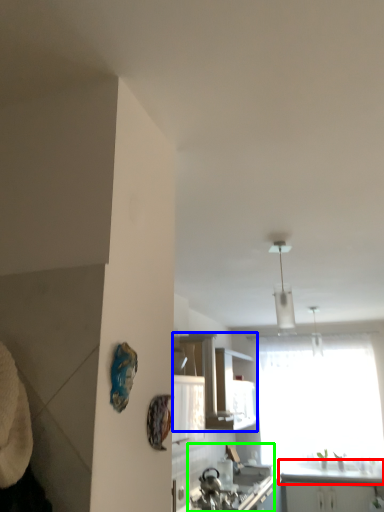
Question: Based on their relative distances, which object is farther from counter top (highlighted by a red box)? Choose from cabinetry (highlighted by a blue box) and sink (highlighted by a green box).

Choices:
 (A) cabinetry
 (B) sink

Answer: (A)